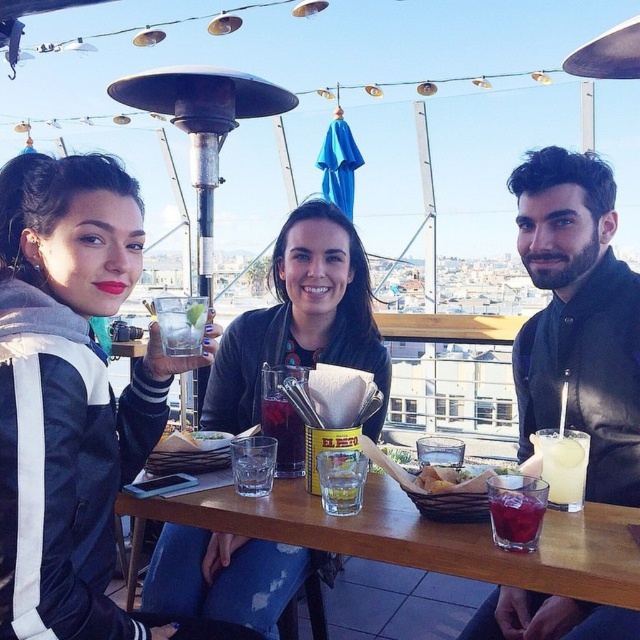
Is black leather jacket at upper right behind golden crumbly bread at table center?

Yes, black leather jacket at upper right is behind golden crumbly bread at table center.

Is black leather jacket at upper right smaller than golden crumbly bread at table center?

Actually, black leather jacket at upper right might be larger than golden crumbly bread at table center.

The image size is (640, 640). In order to click on black leather jacket at upper right in this screenshot , I will do `click(579, 317)`.

Can you confirm if wooden table at center is positioned to the right of clear glass with ice at center?

Yes, wooden table at center is to the right of clear glass with ice at center.

Is wooden table at center positioned before clear glass with ice at center?

That is True.

Is point (196, 509) positioned after point (172, 324)?

No, (196, 509) is in front of (172, 324).

Locate an element on the screen. The image size is (640, 640). wooden table at center is located at coordinates (419, 538).

Can you confirm if matte black jacket at left is shorter than yellow paper at center?

Incorrect, matte black jacket at left's height does not fall short of yellow paper at center's.

Who is more distant from viewer, (x=0, y=477) or (x=276, y=464)?

Point (x=276, y=464)

The image size is (640, 640). I want to click on matte black jacket at left, so click(x=74, y=396).